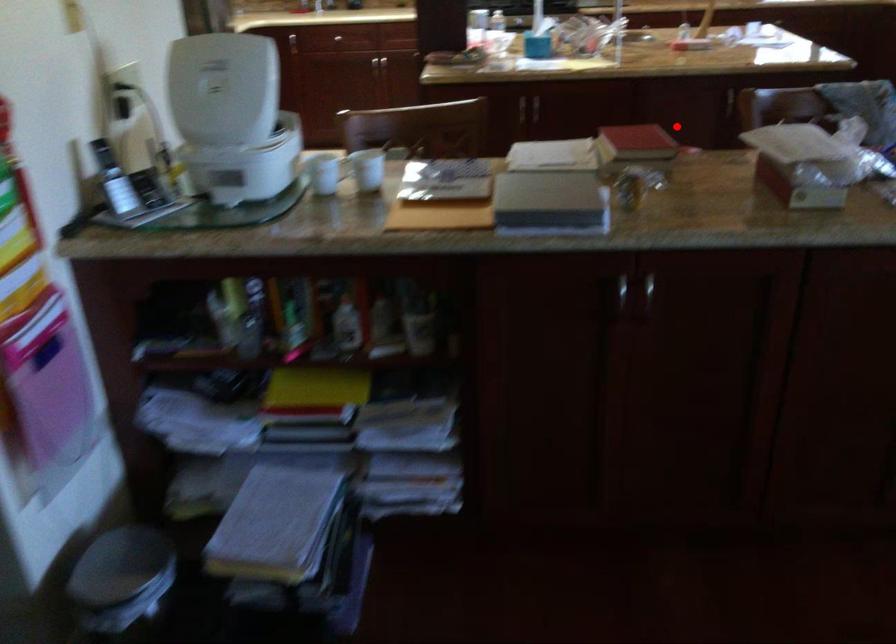
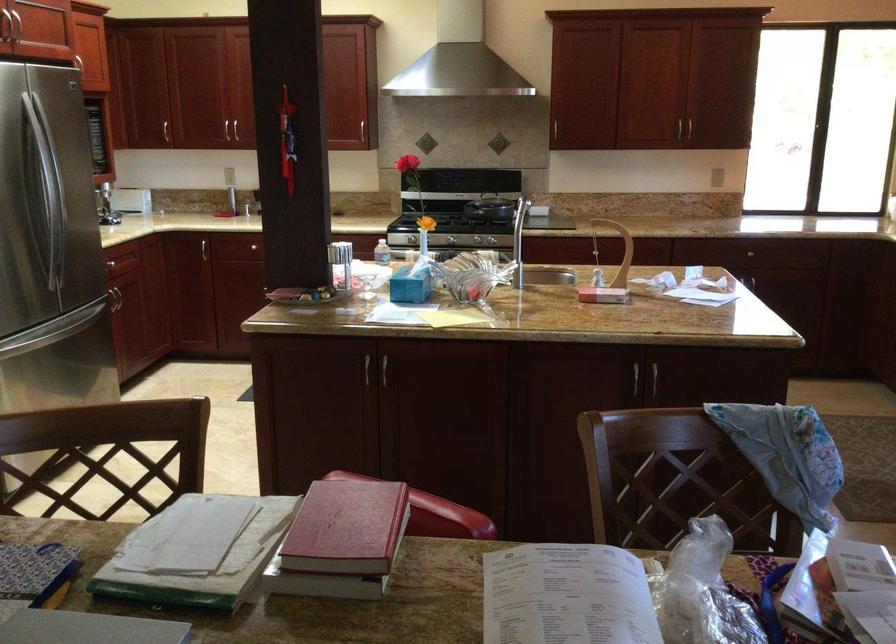
Question: I am providing you with two images of the same scene from different viewpoints. Given a red point in image1, look at the same physical point in image2. Is it:

Choices:
 (A) Closer to the viewpoint
 (B) Farther from the viewpoint

Answer: (A)